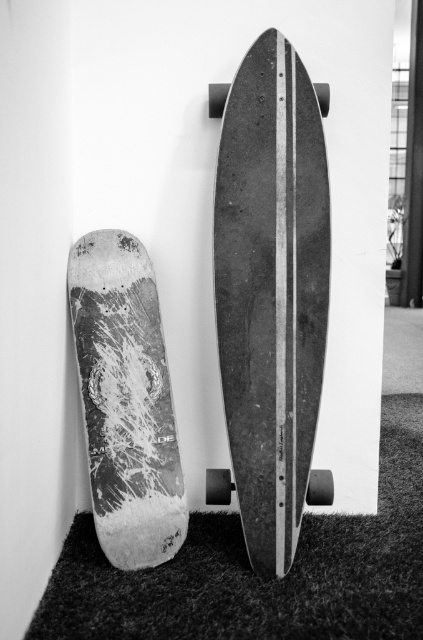
Who is higher up, smooth wood skateboard at center or speckled wood skateboard at left?

smooth wood skateboard at center

Which is below, smooth wood skateboard at center or speckled wood skateboard at left?

speckled wood skateboard at left

Image resolution: width=423 pixels, height=640 pixels. I want to click on smooth wood skateboard at center, so click(271, 291).

Which is behind, point (365, 628) or point (125, 515)?

The point (125, 515) is more distant.

Which is in front, point (126, 616) or point (109, 392)?

Point (126, 616) is more forward.

Is point (420, 452) less distant than point (115, 276)?

No.

The height and width of the screenshot is (640, 423). Identify the location of textured carpet at lower center. (257, 577).

In order to click on smooth wood skateboard at center in this screenshot , I will do `click(271, 291)`.

Consider the image. Which of these two, smooth wood skateboard at center or textured carpet at lower center, stands shorter?

Standing shorter between the two is textured carpet at lower center.

Who is more forward, (252, 150) or (206, 534)?

Positioned in front is point (252, 150).

You are a GUI agent. You are given a task and a screenshot of the screen. Output one action in this format:
    pyautogui.click(x=<x>, y=<y>)
    Task: Click on the smooth wood skateboard at center
    The image size is (423, 640).
    Given the screenshot: What is the action you would take?
    pyautogui.click(x=271, y=291)